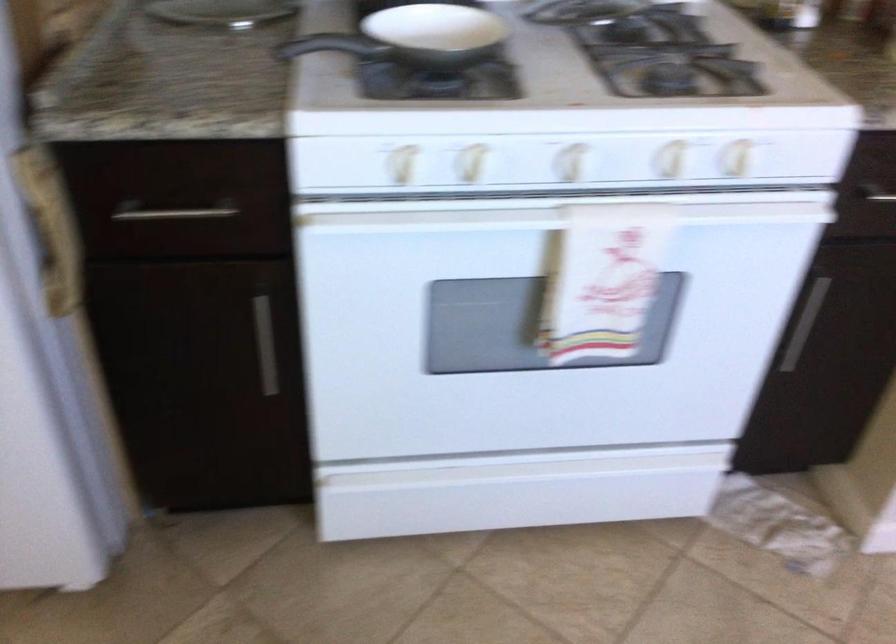
The width and height of the screenshot is (896, 644). What do you see at coordinates (315, 44) in the screenshot? I see `the black pan handle` at bounding box center [315, 44].